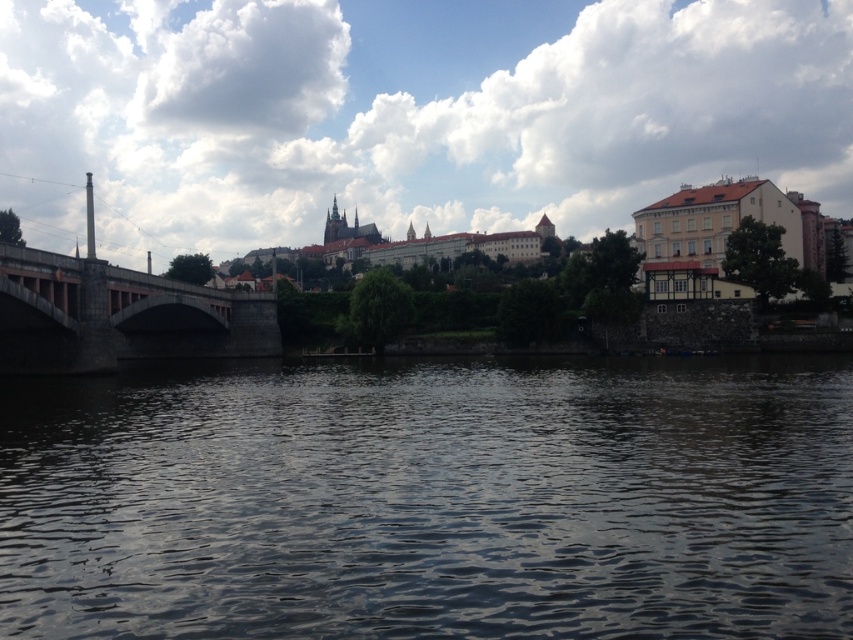
Question: Which point is farther to the camera?

Choices:
 (A) (42, 264)
 (B) (96, 422)

Answer: (A)

Question: Does dark water at center have a smaller size compared to dark gray stone bridge at left?

Choices:
 (A) yes
 (B) no

Answer: (B)

Question: Observing the image, what is the correct spatial positioning of dark water at center in reference to dark gray stone bridge at left?

Choices:
 (A) above
 (B) below

Answer: (B)

Question: Which point is closer to the camera?

Choices:
 (A) (809, 561)
 (B) (109, 346)

Answer: (A)

Question: Considering the relative positions of dark water at center and dark gray stone bridge at left in the image provided, where is dark water at center located with respect to dark gray stone bridge at left?

Choices:
 (A) below
 (B) above

Answer: (A)